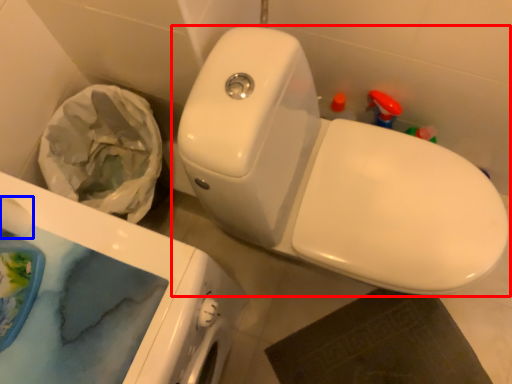
Question: Which of the following is the closest to the observer, toilet (highlighted by a red box) or toilet paper (highlighted by a blue box)?

Choices:
 (A) toilet
 (B) toilet paper

Answer: (A)